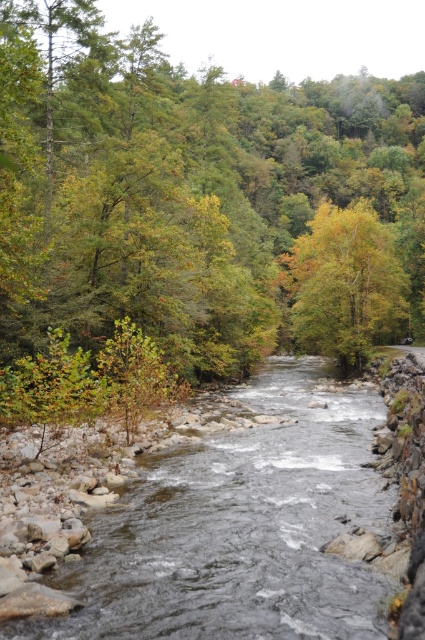
Is clear water at center above yellow-green leaves at center?

Incorrect, clear water at center is not positioned above yellow-green leaves at center.

Is point (283, 480) more distant than point (348, 268)?

No.

Image resolution: width=425 pixels, height=640 pixels. I want to click on clear water at center, so click(240, 529).

Between green leafy tree at upper center and yellow-green leaves at center, which one is positioned lower?

yellow-green leaves at center is below.

Which is above, green leafy tree at upper center or yellow-green leaves at center?

green leafy tree at upper center is higher up.

Is point (215, 83) positioned behind point (360, 352)?

Yes, it is behind point (360, 352).

At what (x,y) coordinates should I click in order to perform the action: click on green leafy tree at upper center. Please return your answer as a coordinate pair (x, y). This screenshot has width=425, height=640. Looking at the image, I should click on (201, 200).

Is green leafy tree at upper center bigger than clear water at center?

Correct, green leafy tree at upper center is larger in size than clear water at center.

Is point (116, 278) less distant than point (241, 438)?

No, (116, 278) is behind (241, 438).

This screenshot has height=640, width=425. Find the location of `green leafy tree at upper center`. green leafy tree at upper center is located at coordinates (201, 200).